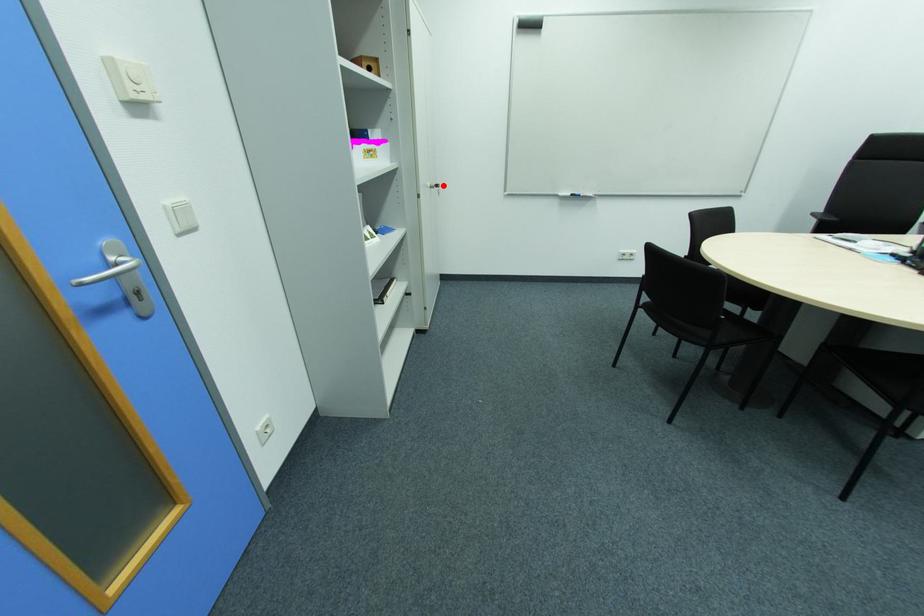
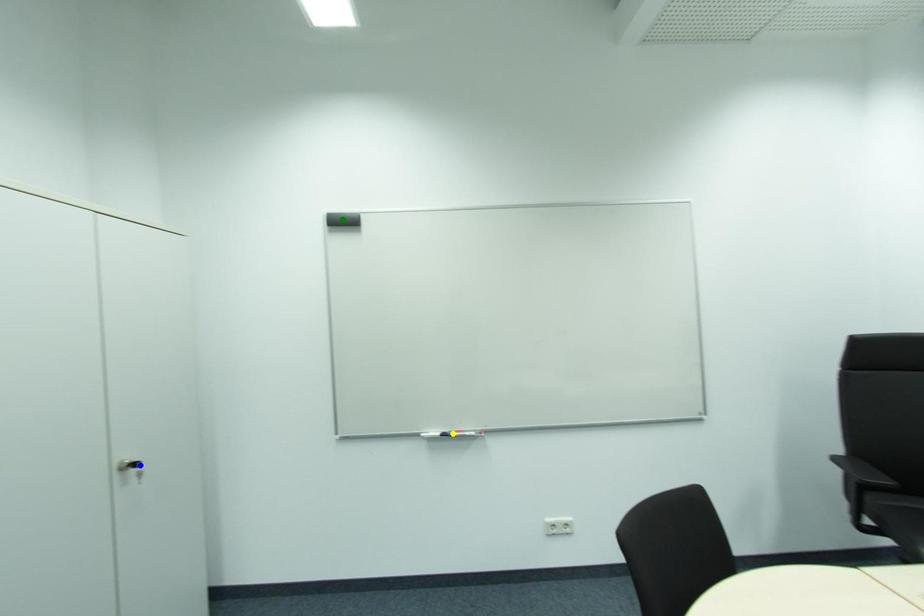
Question: I am providing you with two images of the same scene from different viewpoints. A red point is marked on the first image. You are given multiple points on the second image. Which point in image 2 represents the same 3d spot as the red point in image 1?

Choices:
 (A) yellow point
 (B) blue point
 (C) green point

Answer: (B)